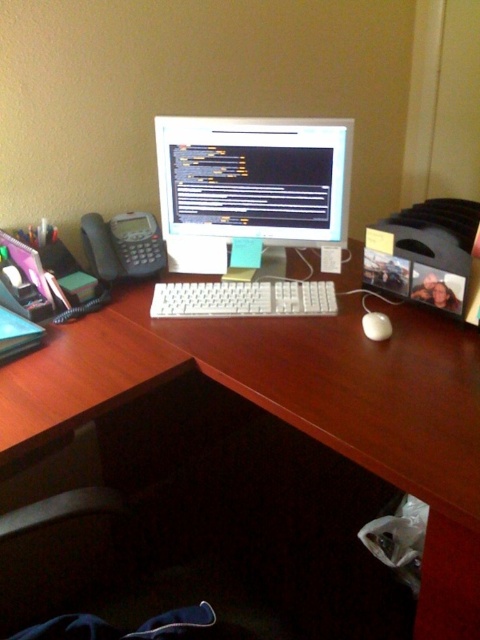
Question: Which of these objects is positioned closest to the white wood computer desk at center?

Choices:
 (A) white plastic keyboard at center
 (B) white plastic monitor at center

Answer: (A)

Question: Does white plastic monitor at center have a smaller size compared to white plastic keyboard at center?

Choices:
 (A) no
 (B) yes

Answer: (A)

Question: Can you confirm if white wood computer desk at center is positioned below white plastic monitor at center?

Choices:
 (A) no
 (B) yes

Answer: (B)

Question: Which of these objects is positioned farthest from the white plastic monitor at center?

Choices:
 (A) white plastic keyboard at center
 (B) white wood computer desk at center
 (C) white matte mouse at center

Answer: (C)

Question: Which of these objects is positioned farthest from the white wood computer desk at center?

Choices:
 (A) white plastic monitor at center
 (B) white matte mouse at center
 (C) white plastic keyboard at center

Answer: (B)

Question: Is white wood computer desk at center above white plastic monitor at center?

Choices:
 (A) yes
 (B) no

Answer: (B)